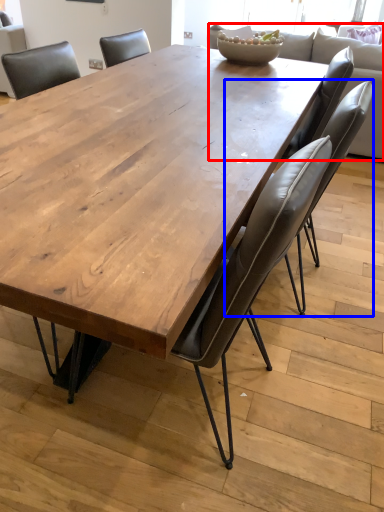
Question: Among these objects, which one is nearest to the camera, couch (highlighted by a red box) or chair (highlighted by a blue box)?

Choices:
 (A) couch
 (B) chair

Answer: (B)